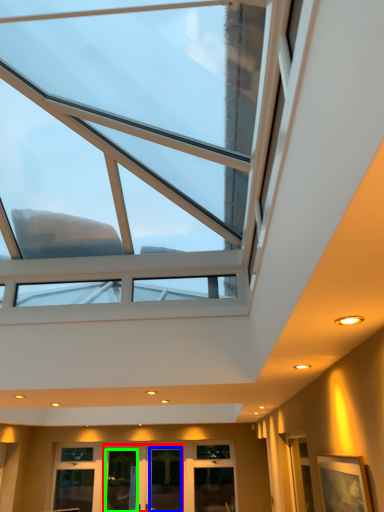
Question: Which object is positioned farthest from glass door (highlighted by a red box)? Select from glass door (highlighted by a blue box) and glass door (highlighted by a green box).

Choices:
 (A) glass door
 (B) glass door

Answer: (A)